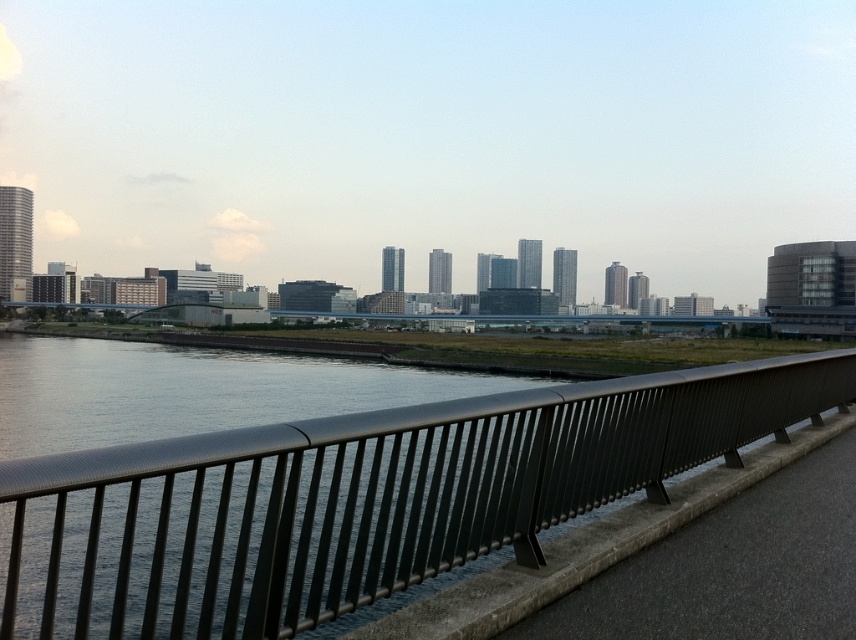
Question: Can you confirm if metallic gray railing at center is positioned to the left of black metal railing at center?

Choices:
 (A) no
 (B) yes

Answer: (B)

Question: Is metallic gray railing at center positioned at the back of black metal railing at center?

Choices:
 (A) no
 (B) yes

Answer: (A)

Question: Does metallic gray railing at center appear under black metal railing at center?

Choices:
 (A) no
 (B) yes

Answer: (A)

Question: Which point appears farthest from the camera in this image?

Choices:
 (A) (740, 365)
 (B) (837, 531)

Answer: (A)